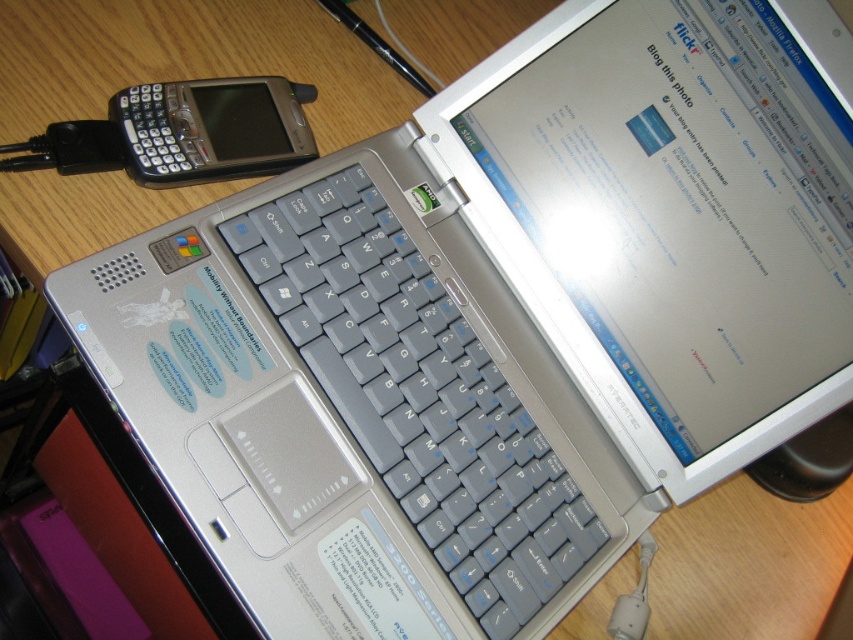
Does point (500, 550) come behind point (218, 84)?

No, (500, 550) is in front of (218, 84).

Can you confirm if gray plastic keyboard at center is positioned below black plastic smartphone at upper left?

Yes.

Between point (364, 168) and point (193, 84), which one is positioned in front?

Point (193, 84)

The image size is (853, 640). I want to click on gray plastic keyboard at center, so click(421, 388).